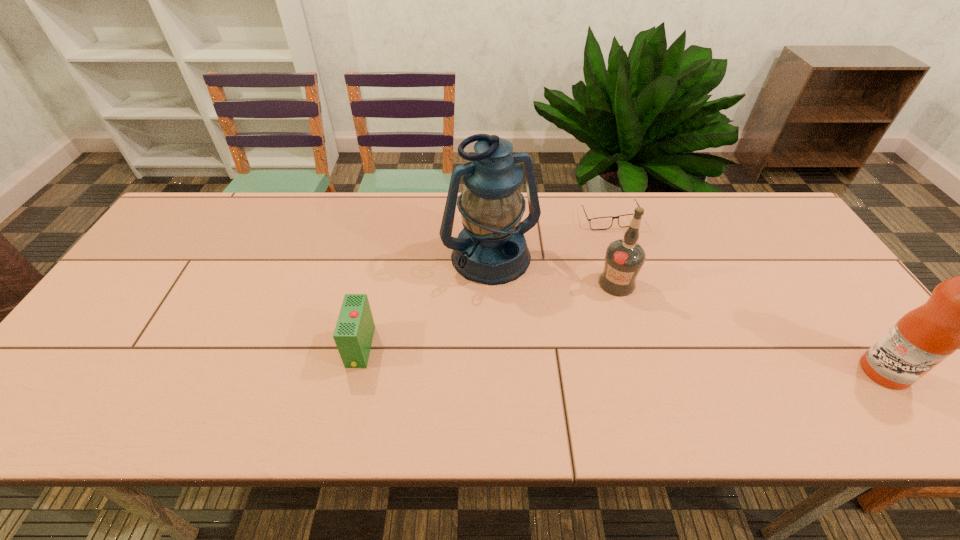
Image resolution: width=960 pixels, height=540 pixels. In order to click on free space located 0.290m on the front-facing side of the fourth tallest object in this screenshot , I will do `click(227, 347)`.

You are a GUI agent. You are given a task and a screenshot of the screen. Output one action in this format:
    pyautogui.click(x=<x>, y=<y>)
    Task: Click on the vacant space positioned 0.320m on the front-facing side of the fourth tallest object
    This screenshot has width=960, height=540.
    Given the screenshot: What is the action you would take?
    pyautogui.click(x=214, y=347)

Identify the location of vacant region located with the lenses facing outward on the shortest object. The width and height of the screenshot is (960, 540). pyautogui.click(x=575, y=288).

Where is `free space located with the lenses facing outward on the shortest object`? free space located with the lenses facing outward on the shortest object is located at coordinates (577, 283).

This screenshot has width=960, height=540. I want to click on free region located with the lenses facing outward on the shortest object, so click(x=566, y=306).

At what (x,y) coordinates should I click in order to perform the action: click on free region located on the front label of the third shortest object. Please return your answer as a coordinate pair (x, y). Image resolution: width=960 pixels, height=540 pixels. Looking at the image, I should click on (635, 369).

You are a GUI agent. You are given a task and a screenshot of the screen. Output one action in this format:
    pyautogui.click(x=<x>, y=<y>)
    Task: Click on the vacant region located on the front label of the third shortest object
    The width and height of the screenshot is (960, 540).
    Given the screenshot: What is the action you would take?
    pyautogui.click(x=624, y=318)

You are a GUI agent. You are given a task and a screenshot of the screen. Output one action in this format:
    pyautogui.click(x=<x>, y=<y>)
    Task: Click on the free location located on the front label of the third shortest object
    Image resolution: width=960 pixels, height=540 pixels.
    Given the screenshot: What is the action you would take?
    pyautogui.click(x=623, y=315)

This screenshot has width=960, height=540. What are the coordinates of `free point located 0.150m on the face of the lantern` in the screenshot? It's located at (536, 333).

At what (x,y) coordinates should I click in order to perform the action: click on vacant space positioned on the face of the lantern. Please return your answer as a coordinate pair (x, y). Looking at the image, I should click on (561, 376).